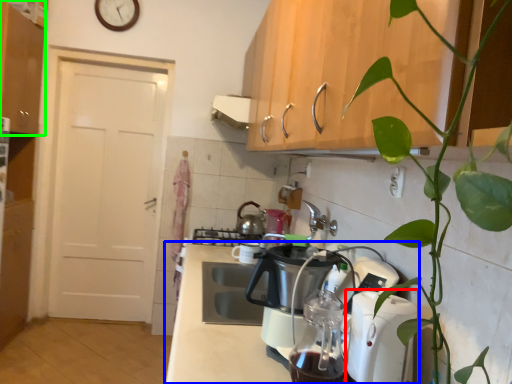
Question: Which object is positioned farthest from kitchen appliance (highlighted by a red box)? Select from countertop (highlighted by a blue box) and cabinetry (highlighted by a green box).

Choices:
 (A) countertop
 (B) cabinetry

Answer: (B)